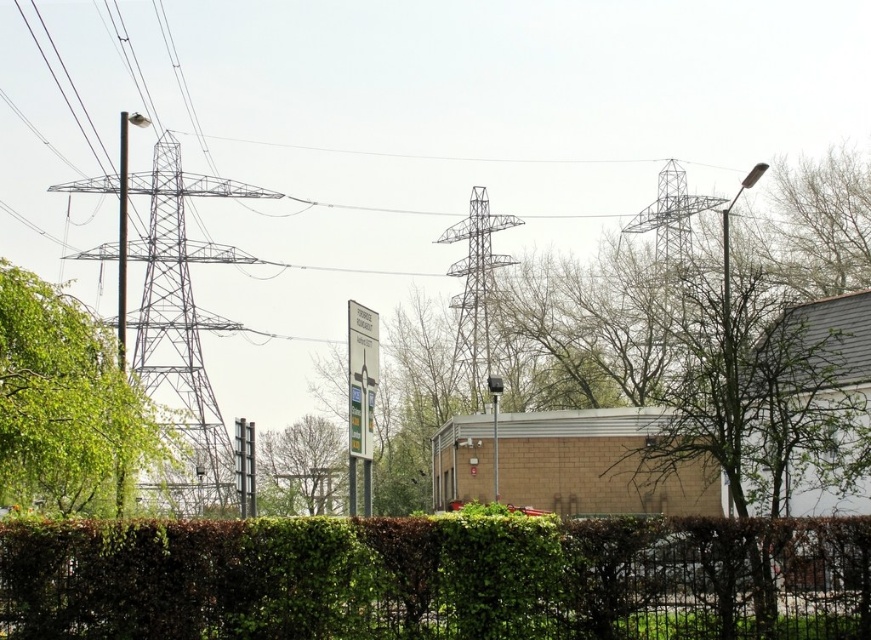
You are standing at the point marked as point [66,403] in the urban landscape. What type of object are you currently standing on?

You are standing on a green leafy tree at left, as the point [66,403] is located on it.

What is located at the coordinates point (753, 419) in the image?

Bare branches at right are located at point (753, 419) in the image.

You are a bird looking for a nesting spot. You see the green leafy tree at left and the green leafy tree at center. Which tree would be a better choice if you prefer nesting in higher branches?

The green leafy tree at left is taller than the green leafy tree at center, so it would be a better choice for nesting in higher branches since it offers greater height.